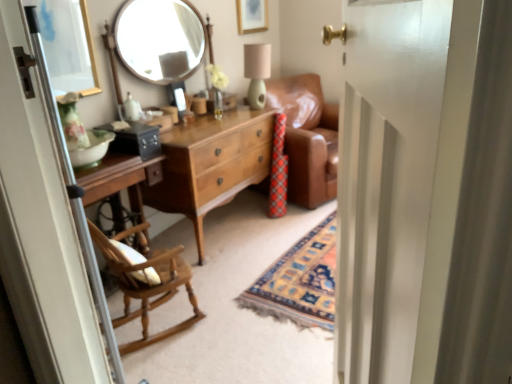
At what (x,y) coordinates should I click in order to perform the action: click on vacant area situated below matte green lampshade at upper center (from a real-world perspective). Please return your answer as a coordinate pair (x, y). The image size is (512, 384). Looking at the image, I should click on (251, 109).